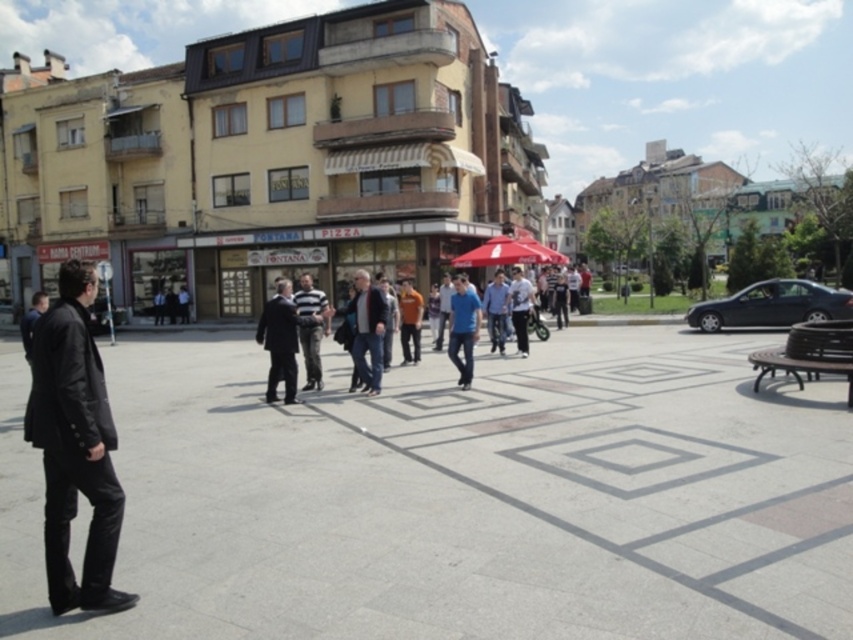
Is gray concrete pavement at center in front of dark gray suit at center?

Yes, gray concrete pavement at center is in front of dark gray suit at center.

Between point (39, 596) and point (323, 316), which one is positioned behind?

The point (323, 316) is more distant.

Find the location of a particular element. The image size is (853, 640). gray concrete pavement at center is located at coordinates (459, 497).

How much distance is there between dark gray suit at center and blue matte shirt at center?

7.29 meters

Does point (273, 353) come farther from viewer compared to point (450, 342)?

That is False.

Which is behind, point (277, 308) or point (460, 374)?

The point (460, 374) is behind.

Image resolution: width=853 pixels, height=640 pixels. Identify the location of dark gray suit at center. (283, 339).

Which is behind, point (503, 308) or point (515, 301)?

The point (503, 308) is behind.

Who is lower down, blue denim jeans at center or white cotton shirt at center?

blue denim jeans at center

You are a GUI agent. You are given a task and a screenshot of the screen. Output one action in this format:
    pyautogui.click(x=<x>, y=<y>)
    Task: Click on the blue denim jeans at center
    This screenshot has height=640, width=853.
    Given the screenshot: What is the action you would take?
    pyautogui.click(x=496, y=310)